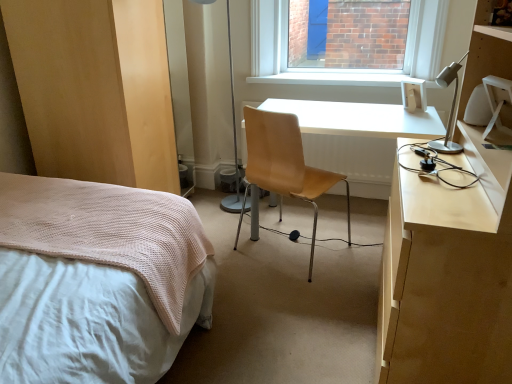
The width and height of the screenshot is (512, 384). In order to click on free spot in front of light brown leather chair at center in this screenshot , I will do `click(297, 306)`.